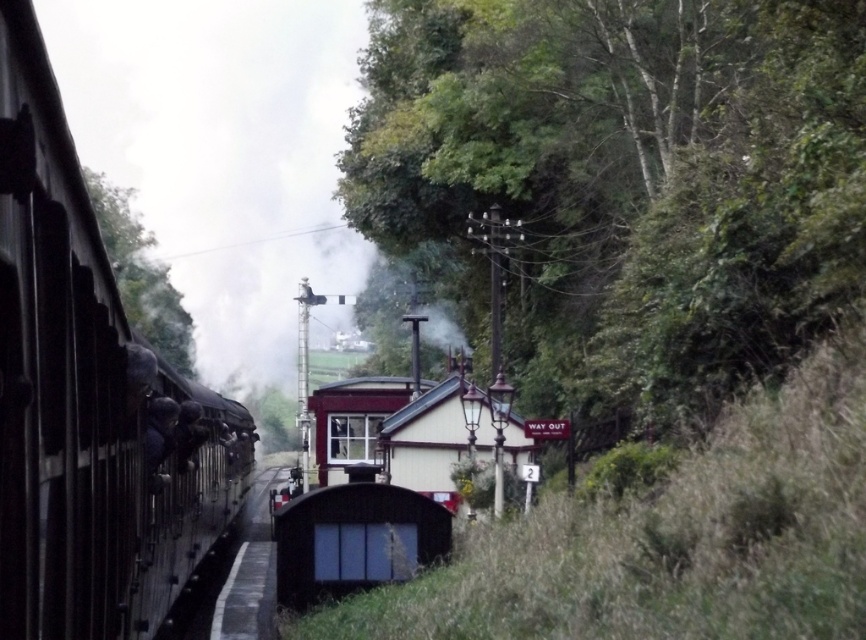
Can you confirm if polished metal train at left is thinner than green leafy tree at left?

Yes, polished metal train at left is thinner than green leafy tree at left.

Who is more forward, (x=124, y=513) or (x=158, y=326)?

Point (x=124, y=513) is in front.

Locate an element on the screen. polished metal train at left is located at coordinates (85, 397).

Does green leafy tree at upper center have a smaller size compared to polished metal train at left?

Actually, green leafy tree at upper center might be larger than polished metal train at left.

Is green leafy tree at upper center wider than polished metal train at left?

Indeed, green leafy tree at upper center has a greater width compared to polished metal train at left.

The image size is (866, 640). What do you see at coordinates (627, 179) in the screenshot? I see `green leafy tree at upper center` at bounding box center [627, 179].

Where is `green leafy tree at upper center`? This screenshot has height=640, width=866. green leafy tree at upper center is located at coordinates (627, 179).

Does green leafy tree at upper center appear over green leafy tree at left?

Yes.

Can you confirm if green leafy tree at upper center is thinner than green leafy tree at left?

Yes, green leafy tree at upper center is thinner than green leafy tree at left.

Find the location of a particular element. This screenshot has height=640, width=866. green leafy tree at upper center is located at coordinates (627, 179).